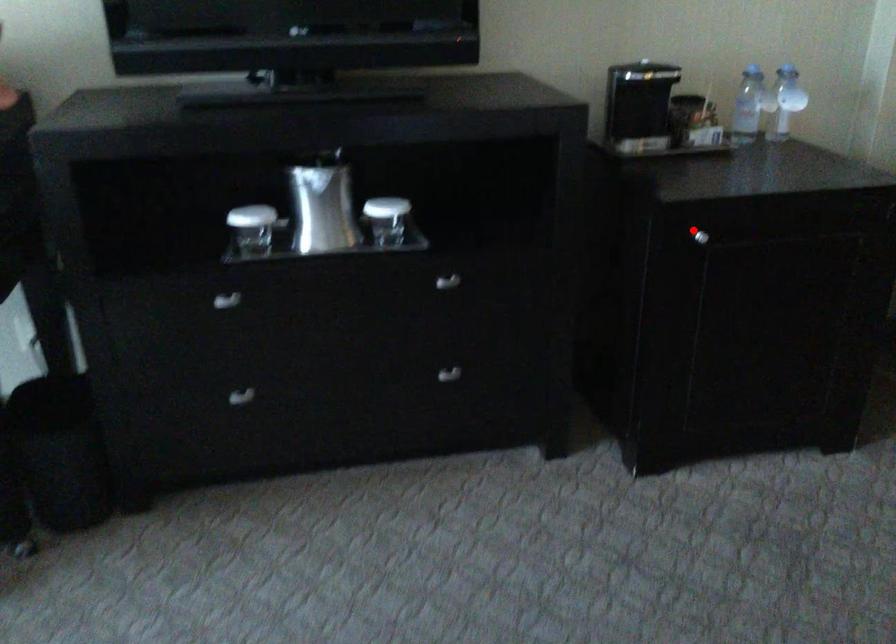
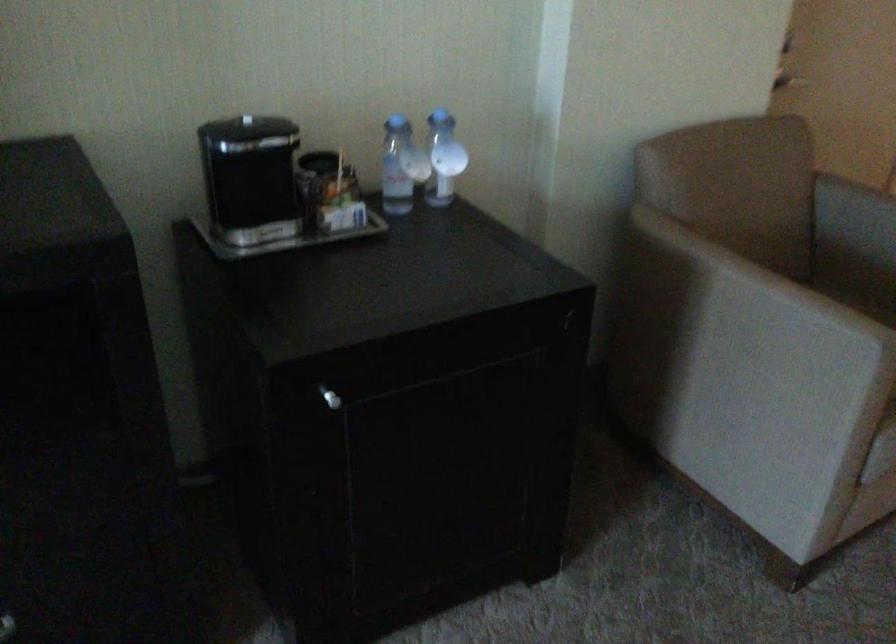
The point at the highlighted location is marked in the first image. Where is the corresponding point in the second image?

(330, 398)